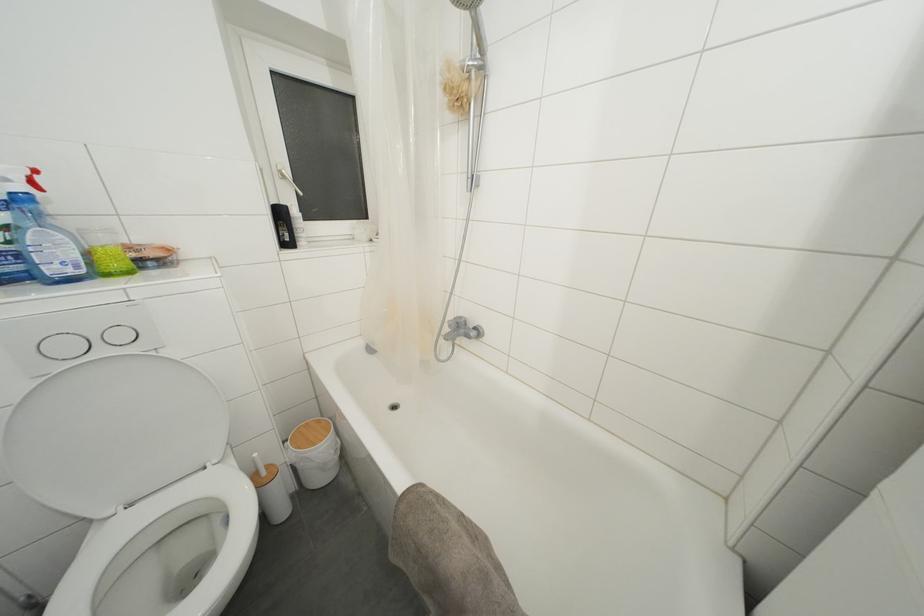
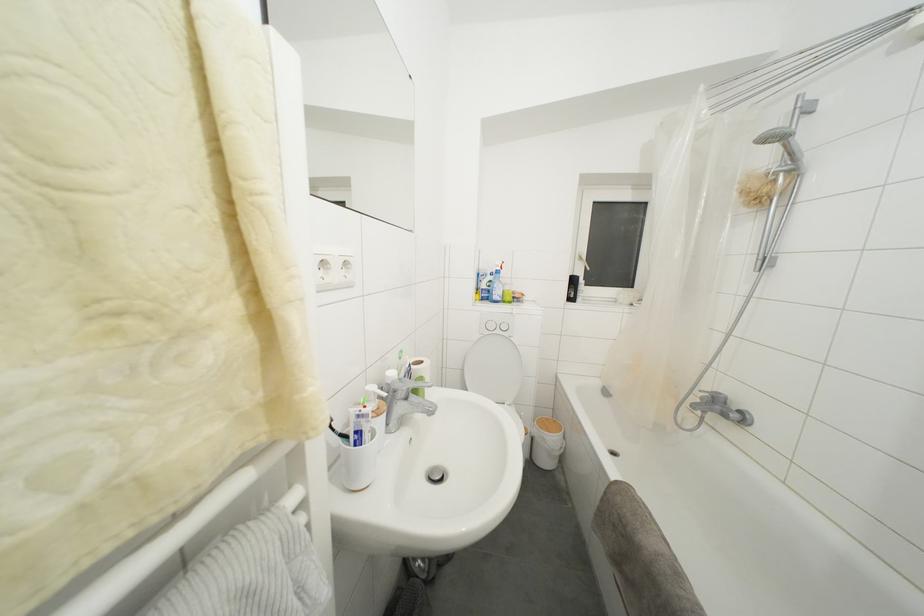
Find the pixel in the second image that matches [304,469] in the first image.

(541, 445)